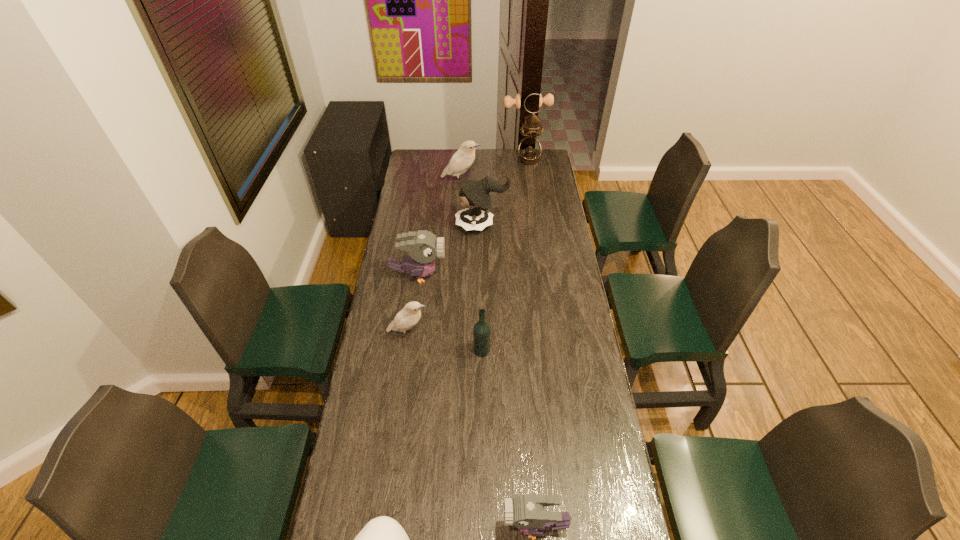
Locate an element on the screen. This screenshot has width=960, height=540. the smaller white bird is located at coordinates (405, 319).

At what (x,y) coordinates should I click in order to perform the action: click on the right gray bird. Please return your answer as a coordinate pair (x, y). Image resolution: width=960 pixels, height=540 pixels. Looking at the image, I should click on (526, 512).

Where is `the smaller gray bird`? The width and height of the screenshot is (960, 540). the smaller gray bird is located at coordinates (526, 512).

Locate an element on the screen. blank space located 0.200m on the front of the tallest object is located at coordinates (533, 187).

Identify the location of vacant point located at the face of the doll. The image size is (960, 540). (443, 225).

Locate an element on the screen. vacant region located 0.170m at the face of the doll is located at coordinates (420, 225).

Where is `vacant area situated at the face of the doll`? The height and width of the screenshot is (540, 960). vacant area situated at the face of the doll is located at coordinates (412, 225).

What are the coordinates of `free space located at the beak of the seventh nearest object` in the screenshot? It's located at (506, 181).

Where is `vacant region located 0.220m on the right of the black vodka`? Image resolution: width=960 pixels, height=540 pixels. vacant region located 0.220m on the right of the black vodka is located at coordinates (549, 350).

At what (x,y) coordinates should I click in order to perform the action: click on blank space located at the beak of the bigger gray bird. Please return your answer as a coordinate pair (x, y). The height and width of the screenshot is (540, 960). Looking at the image, I should click on (471, 275).